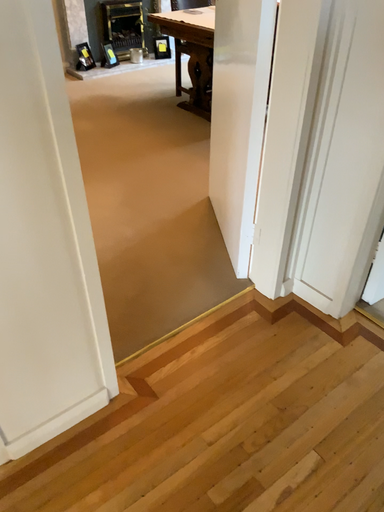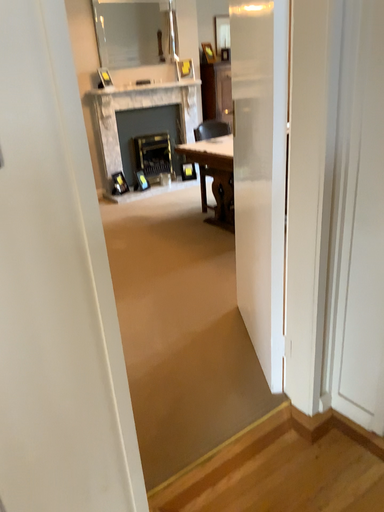
Question: How did the camera likely rotate when shooting the video?

Choices:
 (A) rotated upward
 (B) rotated downward

Answer: (A)